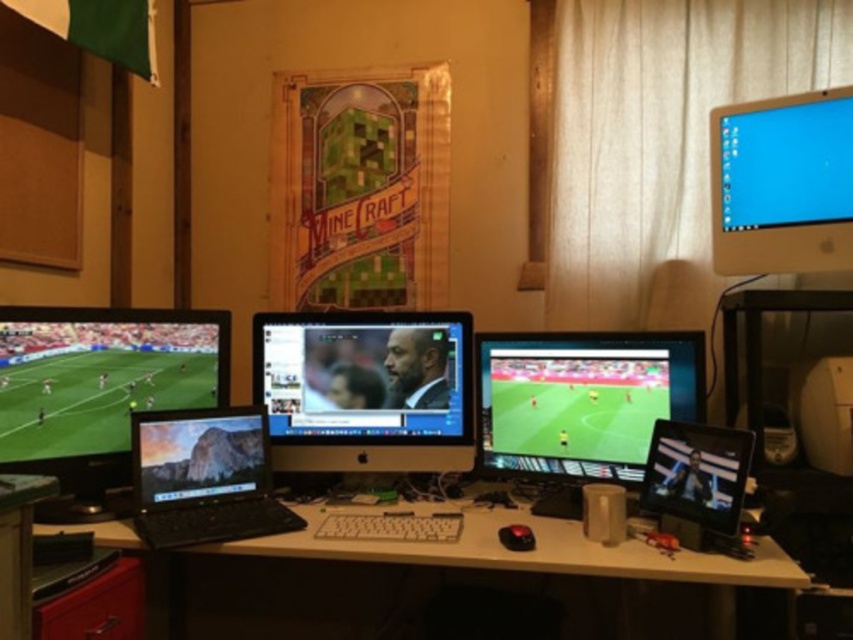
Which of these two, black glossy laptop at center or white plastic keyboard at center, stands shorter?

white plastic keyboard at center is shorter.

The image size is (853, 640). I want to click on black glossy laptop at center, so click(x=204, y=477).

Is point (151, 477) positioned in front of point (405, 532)?

No, (151, 477) is further to viewer.

The image size is (853, 640). Find the location of `black glossy laptop at center`. black glossy laptop at center is located at coordinates (204, 477).

Is white glossy monitor at upper right further to the viewer compared to black glossy laptop at center?

Yes, white glossy monitor at upper right is behind black glossy laptop at center.

Between white glossy monitor at upper right and black glossy laptop at center, which one is positioned lower?

black glossy laptop at center is lower down.

Is point (828, 220) positioned behind point (178, 429)?

No, it is not.

Locate an element on the screen. The image size is (853, 640). white glossy monitor at upper right is located at coordinates (782, 182).

Does white matte computer desk at center have a smaller size compared to white plastic keyboard at center?

Actually, white matte computer desk at center might be larger than white plastic keyboard at center.

Does white matte computer desk at center appear on the right side of white plastic keyboard at center?

Yes, white matte computer desk at center is to the right of white plastic keyboard at center.

Find the location of `white matte computer desk at center`. white matte computer desk at center is located at coordinates (538, 554).

The width and height of the screenshot is (853, 640). I want to click on white matte computer desk at center, so click(538, 554).